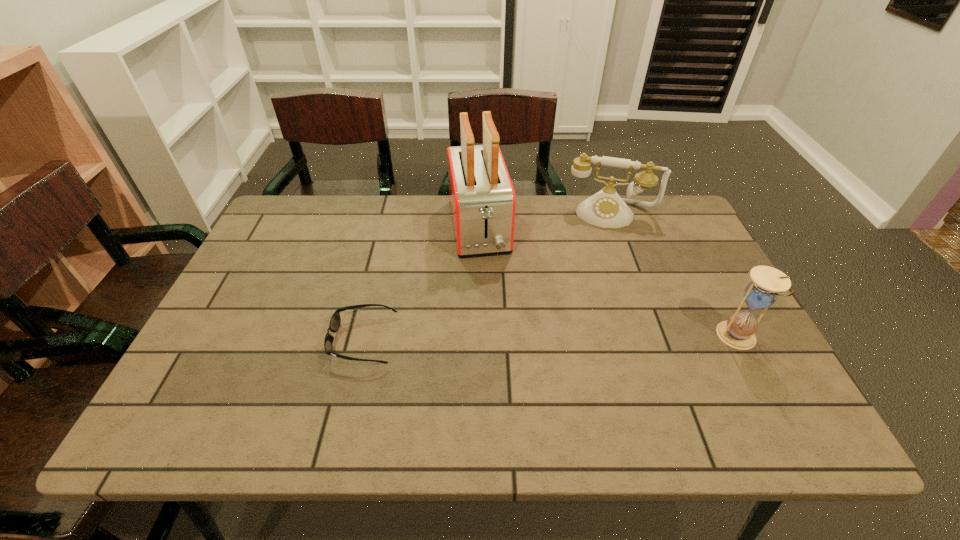
Find the location of a particular element. sunglasses is located at coordinates (335, 321).

Locate an element on the screen. the shortest object is located at coordinates (335, 321).

Identify the location of hourglass. (738, 331).

Locate an element on the screen. The image size is (960, 540). telephone is located at coordinates (606, 209).

You are a GUI agent. You are given a task and a screenshot of the screen. Output one action in this format:
    pyautogui.click(x=<x>, y=<y>)
    Task: Click on the second object from left to right
    The height and width of the screenshot is (540, 960).
    Given the screenshot: What is the action you would take?
    click(482, 198)

Where is `toaster`? The width and height of the screenshot is (960, 540). toaster is located at coordinates (482, 198).

Image resolution: width=960 pixels, height=540 pixels. What are the coordinates of `blank space located 0.190m on the front-facing side of the shortest object` in the screenshot? It's located at (251, 340).

Find the location of `free space located on the front-facing side of the shortest object`. free space located on the front-facing side of the shortest object is located at coordinates (212, 340).

At what (x,y) coordinates should I click in order to perform the action: click on vacant space situated on the front-facing side of the shortest object. Please return your answer as a coordinate pair (x, y). The image size is (960, 540). Looking at the image, I should click on (242, 340).

Locate an element on the screen. This screenshot has height=540, width=960. blank area located 0.320m on the back of the hourglass is located at coordinates (684, 238).